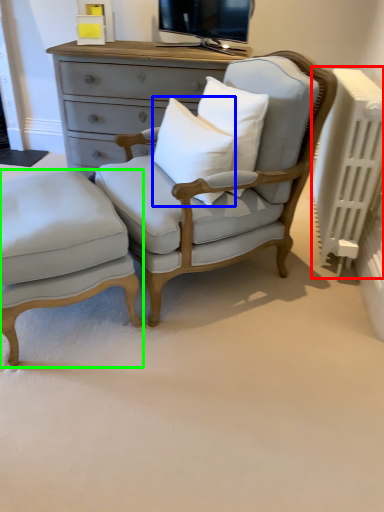
Question: Considering the real-world distances, which object is closest to radiator (highlighted by a red box)? pillow (highlighted by a blue box) or nightstand (highlighted by a green box).

Choices:
 (A) pillow
 (B) nightstand

Answer: (A)